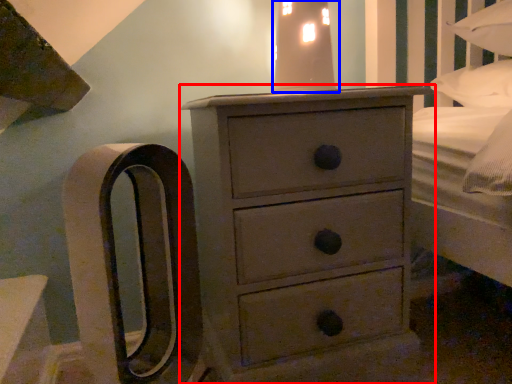
Question: Among these objects, which one is farthest to the camera, chest of drawers (highlighted by a red box) or bedside lamp (highlighted by a blue box)?

Choices:
 (A) chest of drawers
 (B) bedside lamp

Answer: (B)